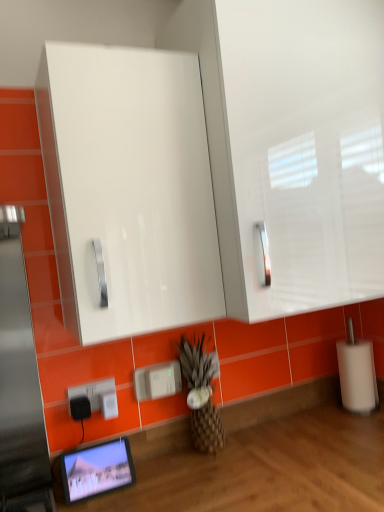
Question: Does white plastic electric outlet at lower left, which is the third electric outlet in left-to-right order, turn towards white plastic charger at lower center, which is the first electric outlet from right to left?

Choices:
 (A) yes
 (B) no

Answer: (B)

Question: From the image's perspective, would you say white plastic electric outlet at lower left, which is the third electric outlet in left-to-right order, is positioned over white plastic charger at lower center, the 4th electric outlet in the left-to-right sequence?

Choices:
 (A) no
 (B) yes

Answer: (A)

Question: Is the depth of white plastic electric outlet at lower left, which is the third electric outlet in left-to-right order, greater than that of white plastic charger at lower center, which is the first electric outlet from right to left?

Choices:
 (A) no
 (B) yes

Answer: (A)

Question: Is white plastic electric outlet at lower left, which is the second electric outlet in right-to-left order, to the left of white plastic charger at lower center, which is the first electric outlet from right to left, from the viewer's perspective?

Choices:
 (A) yes
 (B) no

Answer: (A)

Question: From a real-world perspective, is white plastic electric outlet at lower left, which is the third electric outlet in left-to-right order, located higher than white plastic charger at lower center, the 4th electric outlet in the left-to-right sequence?

Choices:
 (A) no
 (B) yes

Answer: (A)

Question: From the image's perspective, does white plastic electric outlet at lower left, which is the third electric outlet in left-to-right order, appear lower than white plastic charger at lower center, the 4th electric outlet in the left-to-right sequence?

Choices:
 (A) no
 (B) yes

Answer: (B)

Question: Considering the relative sizes of black plastic electric outlet at lower left, which is the 4th electric outlet from right to left, and white plastic charger at lower center, which is the first electric outlet from right to left, in the image provided, is black plastic electric outlet at lower left, which is the 4th electric outlet from right to left, smaller than white plastic charger at lower center, which is the first electric outlet from right to left,?

Choices:
 (A) yes
 (B) no

Answer: (A)

Question: Can you confirm if black plastic electric outlet at lower left, which is the 1th electric outlet from left to right, is thinner than white plastic charger at lower center, which is the first electric outlet from right to left?

Choices:
 (A) no
 (B) yes

Answer: (A)

Question: Considering the relative sizes of black plastic electric outlet at lower left, which is the 1th electric outlet from left to right, and white plastic charger at lower center, which is the first electric outlet from right to left, in the image provided, is black plastic electric outlet at lower left, which is the 1th electric outlet from left to right, taller than white plastic charger at lower center, which is the first electric outlet from right to left,?

Choices:
 (A) no
 (B) yes

Answer: (A)

Question: Is black plastic electric outlet at lower left, which is the 1th electric outlet from left to right, at the left side of white plastic charger at lower center, which is the first electric outlet from right to left?

Choices:
 (A) no
 (B) yes

Answer: (B)

Question: Is black plastic electric outlet at lower left, which is the 1th electric outlet from left to right, with white plastic charger at lower center, the 4th electric outlet in the left-to-right sequence?

Choices:
 (A) no
 (B) yes

Answer: (A)

Question: Could you tell me if black plastic electric outlet at lower left, which is the 1th electric outlet from left to right, is turned towards white plastic charger at lower center, which is the first electric outlet from right to left?

Choices:
 (A) yes
 (B) no

Answer: (B)

Question: Would you say white plastic electric outlet at lower left, positioned as the 2th electric outlet in left-to-right order, is outside white plastic charger at lower center, which is the first electric outlet from right to left?

Choices:
 (A) yes
 (B) no

Answer: (A)